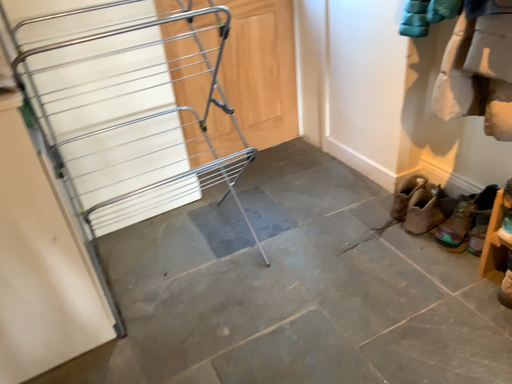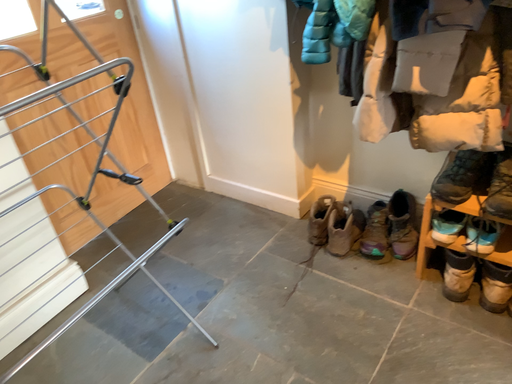
Question: How did the camera likely rotate when shooting the video?

Choices:
 (A) rotated downward
 (B) rotated upward

Answer: (B)